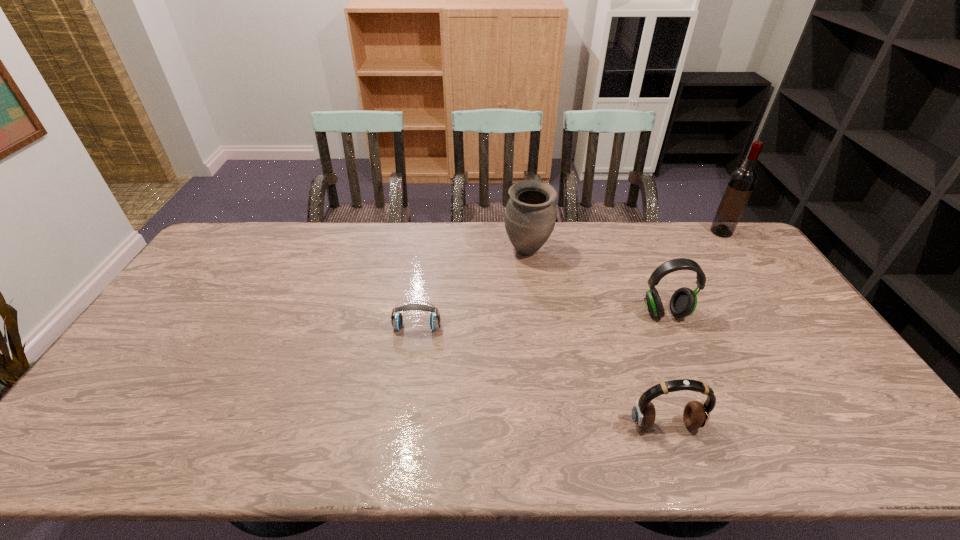
Where is `the tallest object`? This screenshot has height=540, width=960. the tallest object is located at coordinates (742, 181).

This screenshot has width=960, height=540. Find the location of `the rightmost object`. the rightmost object is located at coordinates (742, 181).

The width and height of the screenshot is (960, 540). Find the location of `the second tallest object`. the second tallest object is located at coordinates (530, 215).

Locate an element on the screen. The width and height of the screenshot is (960, 540). urn is located at coordinates (530, 215).

At what (x,y) coordinates should I click in order to perform the action: click on the third tallest object. Please return your answer as a coordinate pair (x, y). The height and width of the screenshot is (540, 960). Looking at the image, I should click on (683, 302).

Locate an element on the screen. This screenshot has width=960, height=540. the nearest object is located at coordinates (696, 414).

Find the location of a particular element. the second tallest headset is located at coordinates (696, 414).

Locate an element on the screen. This screenshot has height=540, width=960. the shortest object is located at coordinates (397, 319).

Where is `the leftmost headset`? the leftmost headset is located at coordinates (397, 319).

You are a GUI agent. You are given a task and a screenshot of the screen. Output one action in this format:
    pyautogui.click(x=<x>, y=<y>)
    Task: Click on the vacant space positioned on the front of the rightmost object
    The width and height of the screenshot is (960, 540).
    Given the screenshot: What is the action you would take?
    pyautogui.click(x=772, y=303)